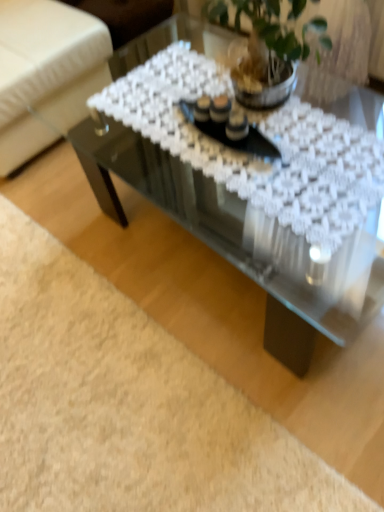
Question: From the image's perspective, relative to white fabric armchair at upper left, is transparent glass coffee table at center above or below?

Choices:
 (A) below
 (B) above

Answer: (A)

Question: Is transparent glass coffee table at center spatially inside white fabric armchair at upper left, or outside of it?

Choices:
 (A) outside
 (B) inside

Answer: (A)

Question: Estimate the real-world distances between objects in this image. Which object is farther from the clear glass plate at center?

Choices:
 (A) transparent glass coffee table at center
 (B) white fabric armchair at upper left

Answer: (B)

Question: Which is nearer to the transparent glass coffee table at center?

Choices:
 (A) clear glass plate at center
 (B) white fabric armchair at upper left

Answer: (A)